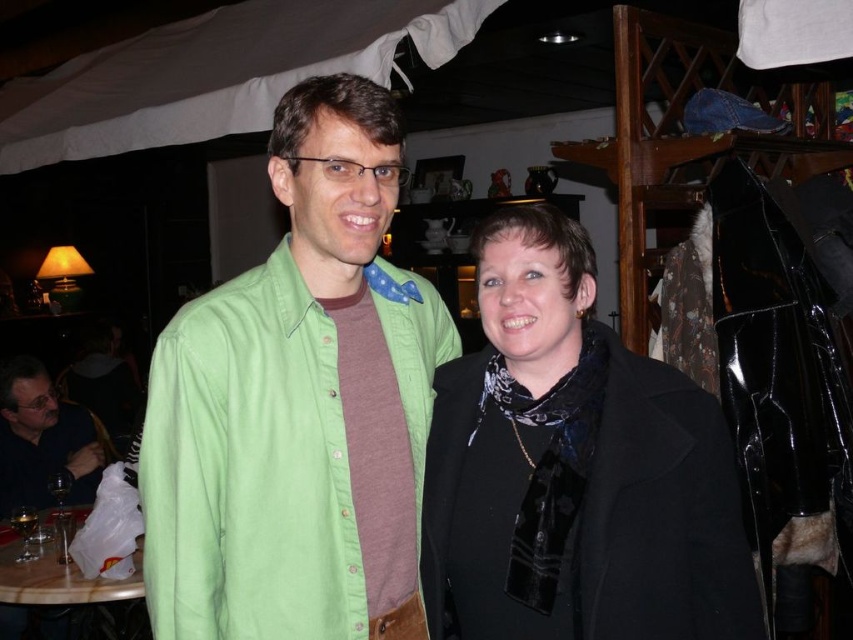
Can you confirm if green cotton shirt at center is positioned to the right of matte black jacket at lower left?

Correct, you'll find green cotton shirt at center to the right of matte black jacket at lower left.

Consider the image. Is the position of green cotton shirt at center less distant than that of matte black jacket at lower left?

Yes, it is in front of matte black jacket at lower left.

Locate an element on the screen. green cotton shirt at center is located at coordinates (299, 404).

The image size is (853, 640). Find the location of `black matte coat at center`. black matte coat at center is located at coordinates (575, 468).

How far apart are black matte coat at center and matte black jacket at lower left?

They are 2.58 meters apart.

Does point (532, 394) lie behind point (6, 500)?

No, it is in front of (6, 500).

Where is `black matte coat at center`? Image resolution: width=853 pixels, height=640 pixels. black matte coat at center is located at coordinates (575, 468).

Can you confirm if green cotton shirt at center is shorter than black matte coat at center?

No, green cotton shirt at center is not shorter than black matte coat at center.

At what (x,y) coordinates should I click in order to perform the action: click on green cotton shirt at center. Please return your answer as a coordinate pair (x, y). Looking at the image, I should click on (299, 404).